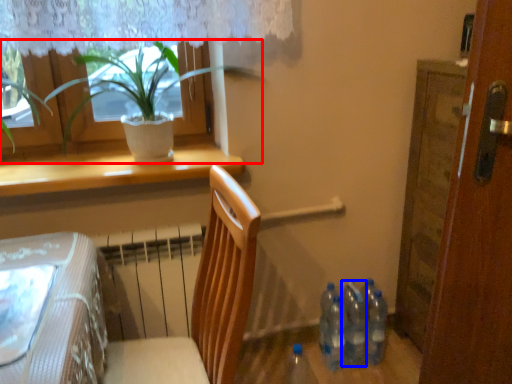
Question: Which object appears closest to the camera in this image, houseplant (highlighted by a red box) or bottle (highlighted by a blue box)?

Choices:
 (A) houseplant
 (B) bottle

Answer: (A)